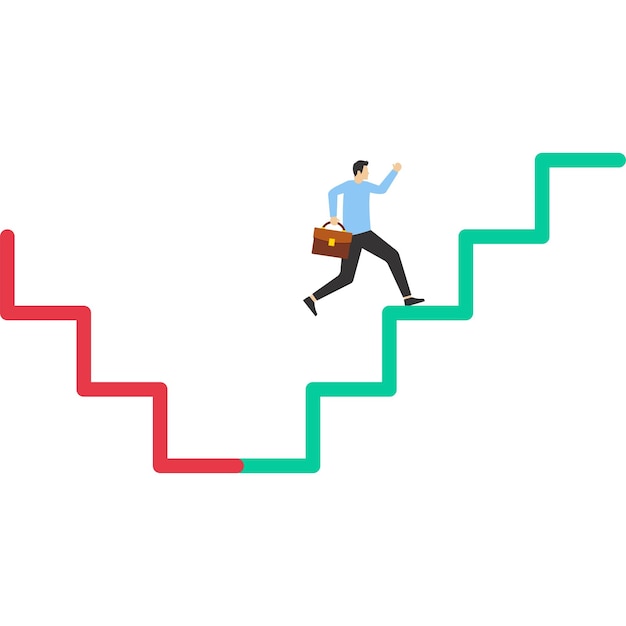
Locate an element on the screen. stair is located at coordinates (41, 310), (111, 387), (337, 394), (429, 310), (499, 237), (562, 158).